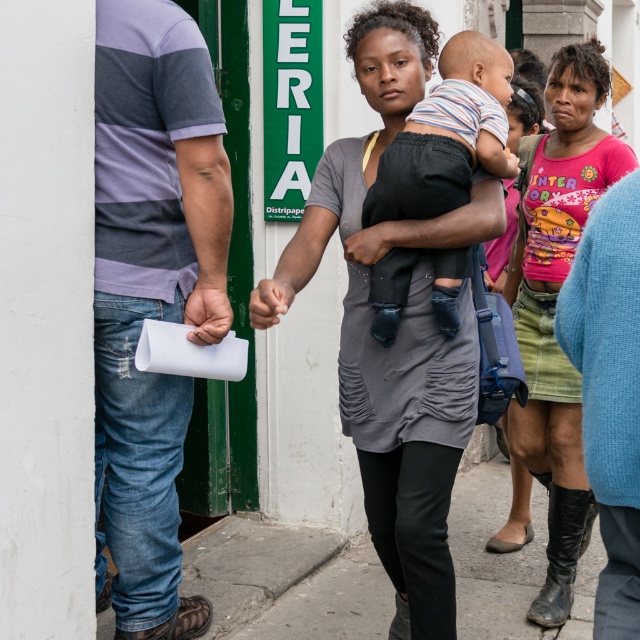
Describe the element at coordinates (150, 292) in the screenshot. I see `striped cotton shirt at left` at that location.

Is striped cotton shirt at left positioned before gray concrete pavement at lower center?

Yes, striped cotton shirt at left is in front of gray concrete pavement at lower center.

Is point (140, 6) closer to camera compared to point (454, 497)?

That is True.

Image resolution: width=640 pixels, height=640 pixels. I want to click on striped cotton shirt at left, so click(150, 292).

Can you confirm if gray concrete pavement at lower center is smaller than striped cotton shirt at center?

Incorrect, gray concrete pavement at lower center is not smaller in size than striped cotton shirt at center.

Between gray concrete pavement at lower center and striped cotton shirt at center, which one is positioned lower?

gray concrete pavement at lower center is lower down.

The width and height of the screenshot is (640, 640). What do you see at coordinates (508, 561) in the screenshot? I see `gray concrete pavement at lower center` at bounding box center [508, 561].

Identify the location of gray concrete pavement at lower center. (508, 561).

Who is positioned more to the left, matte pink shirt at center or striped cotton shirt at center?

Positioned to the left is striped cotton shirt at center.

Does matte pink shirt at center appear on the left side of striped cotton shirt at center?

Incorrect, matte pink shirt at center is not on the left side of striped cotton shirt at center.

Which is behind, point (544, 460) or point (472, 45)?

The point (544, 460) is more distant.

Where is `matte pink shirt at center`? The image size is (640, 640). matte pink shirt at center is located at coordinates (554, 305).